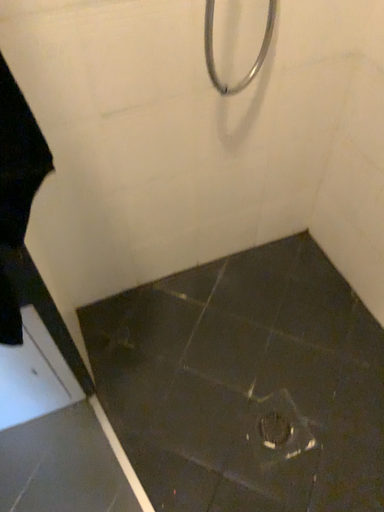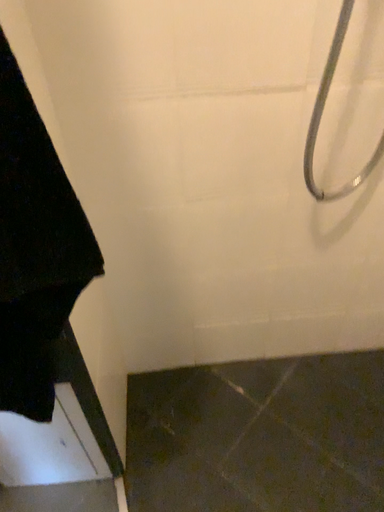
Question: Which way did the camera rotate in the video?

Choices:
 (A) rotated right
 (B) rotated left

Answer: (B)